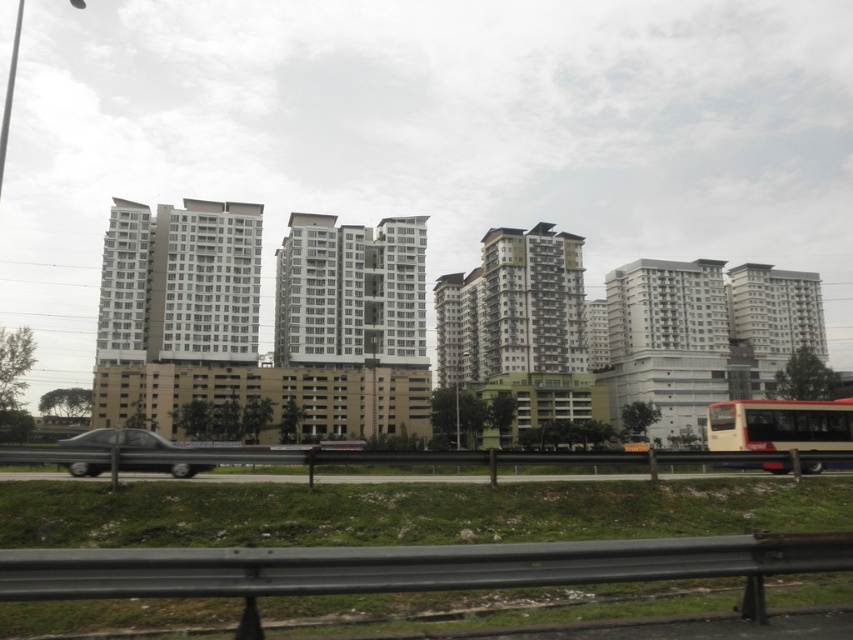
You are a pedestrian standing on the grassy area near the metal guardrail. You see the yellow matte bus at lower right and the metallic silver car at lower left. Which vehicle is closer to the right edge of the image?

The yellow matte bus at lower right is to the right of the metallic silver car at lower left, so it is closer to the right edge of the image.

You are a delivery drone operator. Your drone needs to fly between the yellow matte bus at lower right and the metallic silver car at lower left. Based on the scene, can you safely navigate the space between them without hitting either vehicle?

The yellow matte bus at lower right is much taller than the metallic silver car at lower left. Since the bus is taller, the drone can fly under it while staying above the car to navigate safely between them.